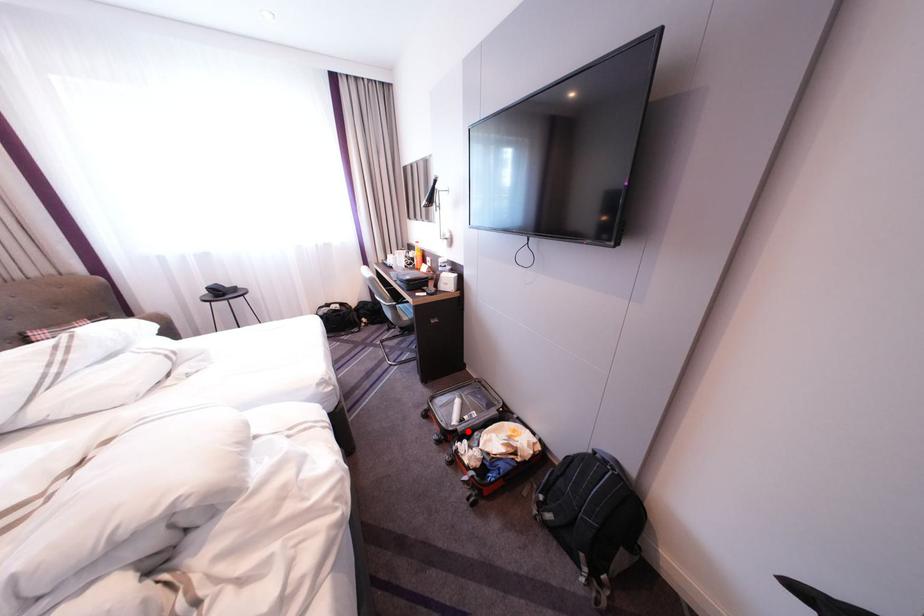
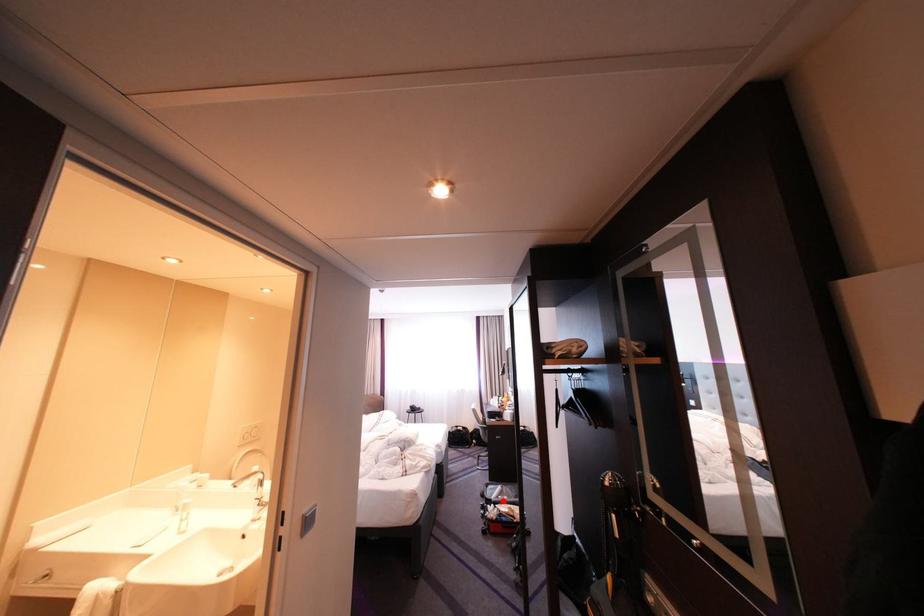
I am providing you with two images of the same scene from different viewpoints. A red point is marked on the first image and another point is marked on the second image. Do the highlighted points in image1 and image2 indicate the same real-world spot?

Yes